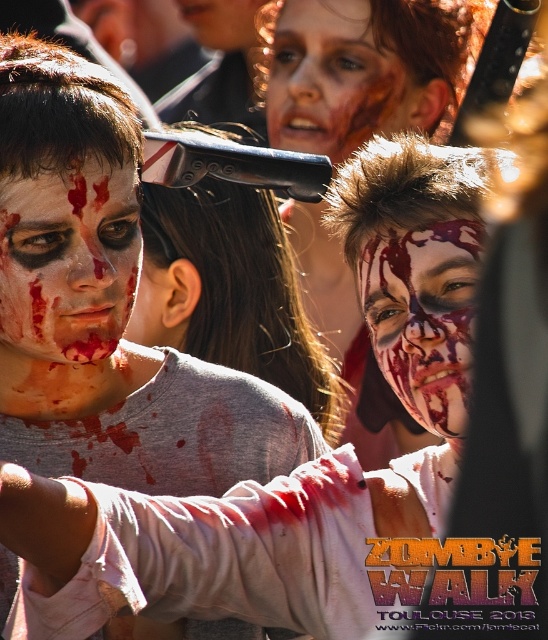
Does matte black baseball cap at center have a lesser height compared to blood-stained face at upper center?

No, matte black baseball cap at center is not shorter than blood-stained face at upper center.

Is matte black baseball cap at center to the right of blood-stained face at upper center from the viewer's perspective?

In fact, matte black baseball cap at center is to the left of blood-stained face at upper center.

The image size is (548, 640). I want to click on matte black baseball cap at center, so click(x=231, y=266).

This screenshot has width=548, height=640. What do you see at coordinates (424, 316) in the screenshot? I see `blood-stained face at center` at bounding box center [424, 316].

In the scene shown: Which is more to the right, blood-stained face at center or blood-stained face at upper center?

From the viewer's perspective, blood-stained face at center appears more on the right side.

The height and width of the screenshot is (640, 548). In order to click on blood-stained face at center in this screenshot , I will do `click(424, 316)`.

Locate an element on the screen. The image size is (548, 640). blood-stained face at center is located at coordinates (424, 316).

Is matte black baseball cap at center above blood-stained face at center?

Incorrect, matte black baseball cap at center is not positioned above blood-stained face at center.

At what (x,y) coordinates should I click in order to perform the action: click on matte black baseball cap at center. Please return your answer as a coordinate pair (x, y). The height and width of the screenshot is (640, 548). Looking at the image, I should click on (231, 266).